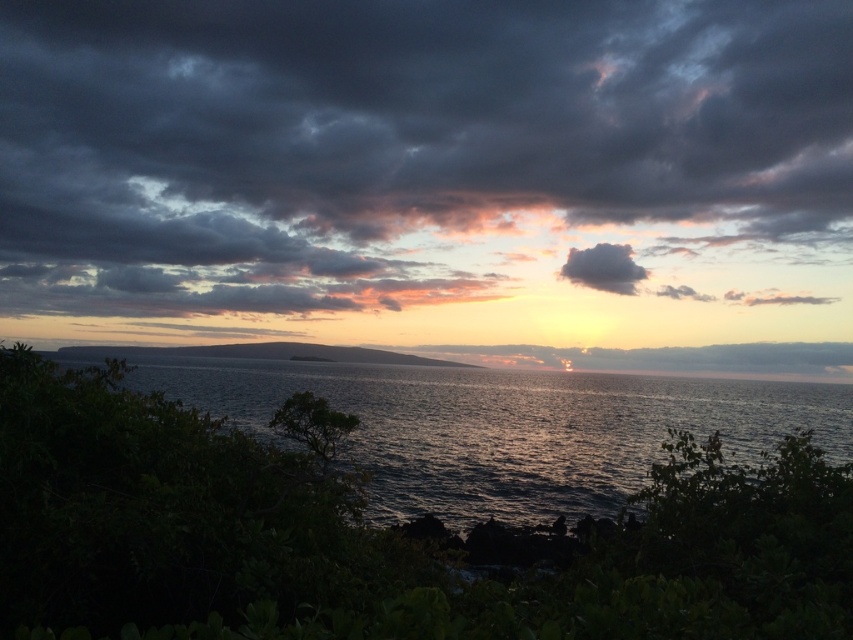
You are a photographer standing at the edge of the water in the sunset scene. You want to capture a photo that includes both the point at coordinates point (306, 227) and point (589, 280). Which point will appear closer to the front of your photo?

Point (306, 227) is further to the camera than point (589, 280), so it will appear closer to the front of the photo.

You are a weather observer analyzing the sunset scene. You notice the dark gray cloud at upper center. Can you determine its exact location in terms of coordinates?

The dark gray cloud at upper center is located at coordinates point (412, 150).